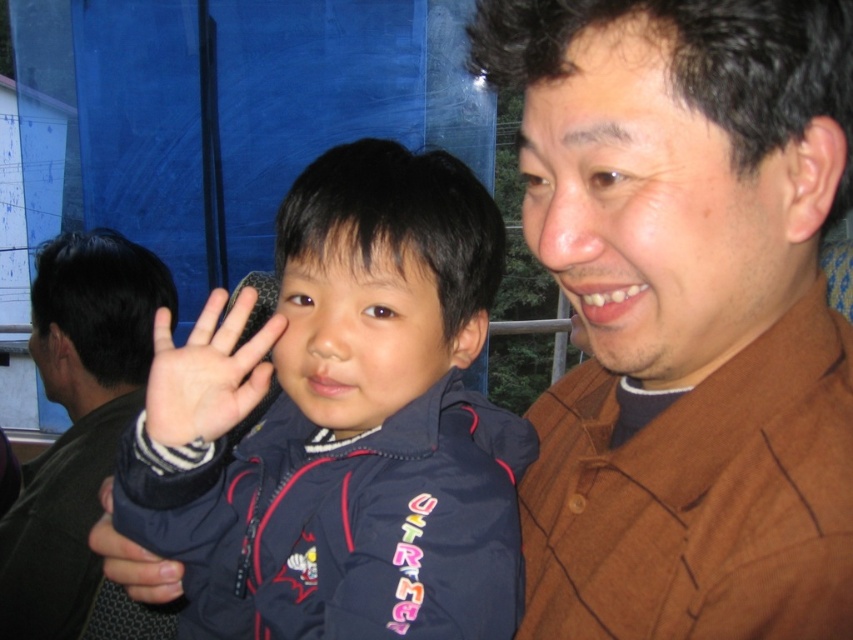
Question: Which of the following is the closest to the observer?

Choices:
 (A) smooth skin hand at center
 (B) dark blue fleece jacket at center
 (C) brown textured shirt at right
 (D) brown textured shirt at upper right

Answer: (D)

Question: Estimate the real-world distances between objects in this image. Which object is farther from the brown textured shirt at right?

Choices:
 (A) brown textured shirt at upper right
 (B) smooth skin hand at center

Answer: (A)

Question: Does brown textured shirt at right have a smaller size compared to matte black hand at center?

Choices:
 (A) yes
 (B) no

Answer: (B)

Question: Does brown textured shirt at upper right come in front of dark blue fleece jacket at center?

Choices:
 (A) no
 (B) yes

Answer: (B)

Question: Is brown textured shirt at upper right above matte black hand at center?

Choices:
 (A) no
 (B) yes

Answer: (B)

Question: Among these objects, which one is nearest to the camera?

Choices:
 (A) matte black hand at center
 (B) smooth skin hand at center

Answer: (B)